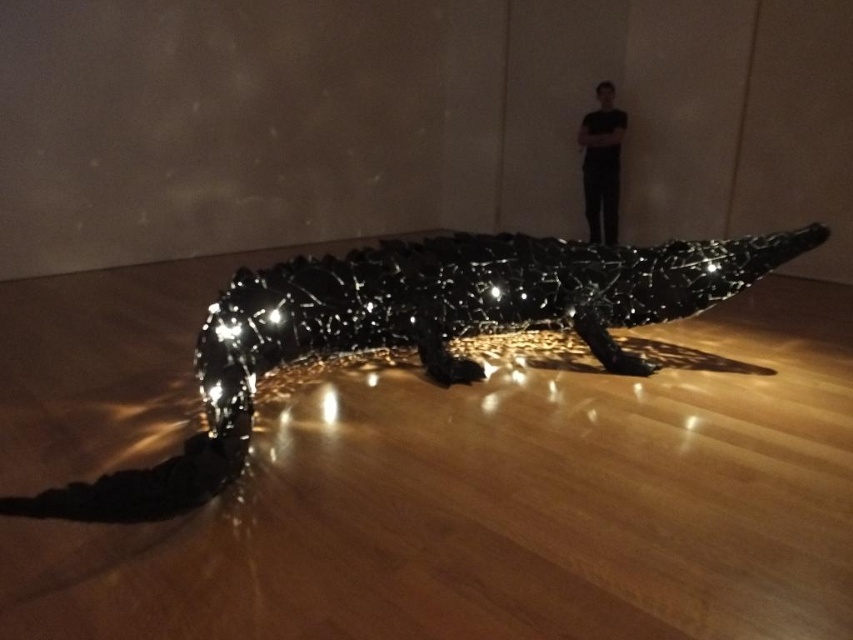
You are an art critic observing the installation. You need to describe the spatial relationship between the glossy black crocodile at center and the black matte clothing at upper center in terms of their sizes. Which object is bigger?

The glossy black crocodile at center is larger in width than the black matte clothing at upper center.

You are standing in the art installation and want to move from the point marked as point (517, 243) to the point marked as point (585, 173). Which direction should you move to reach your destination?

You should move backward to reach point (585, 173) because point (517, 243) is in front of it.